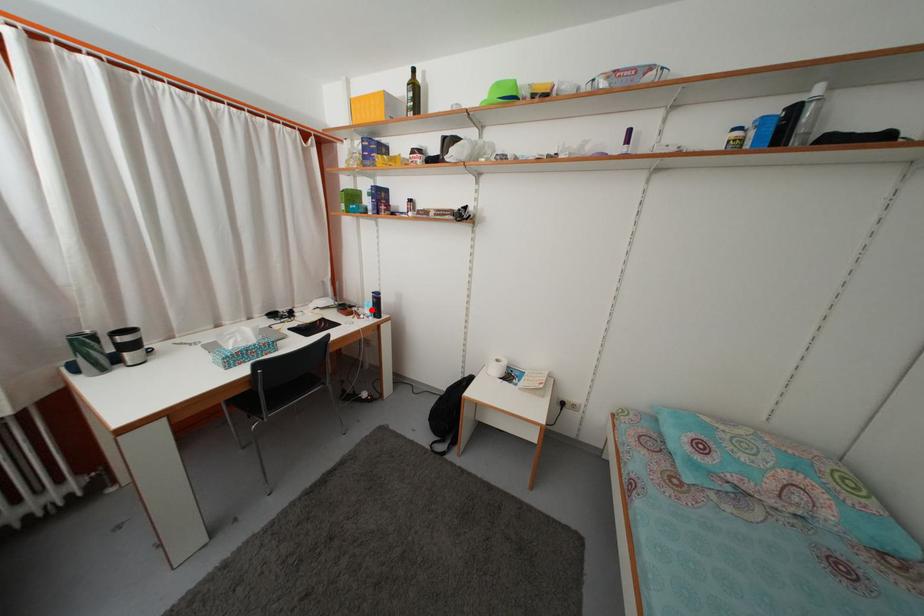
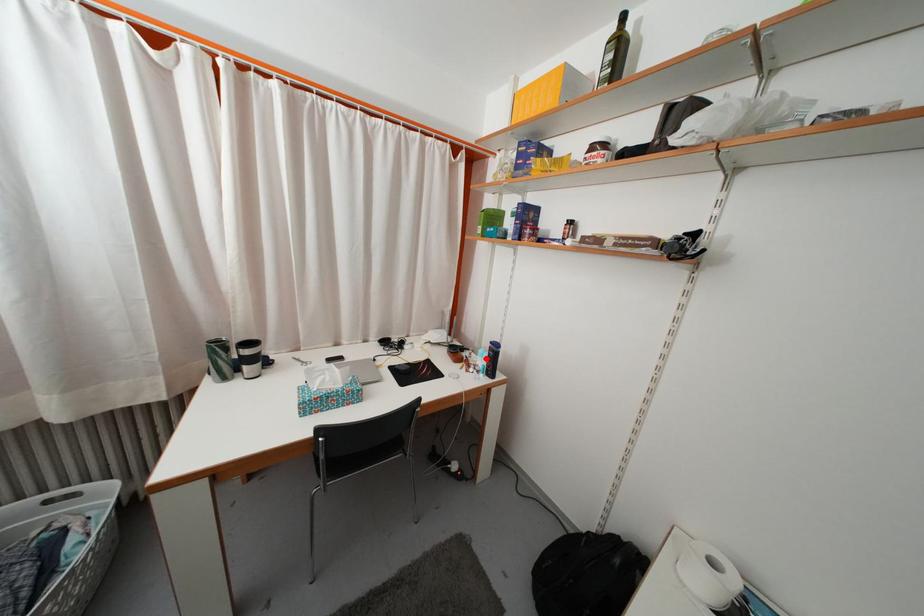
I am providing you with two images of the same scene from different viewpoints. A red point is marked on the first image and another point is marked on the second image. Are the points marked in image1 and image2 representing the same 3D position?

Yes